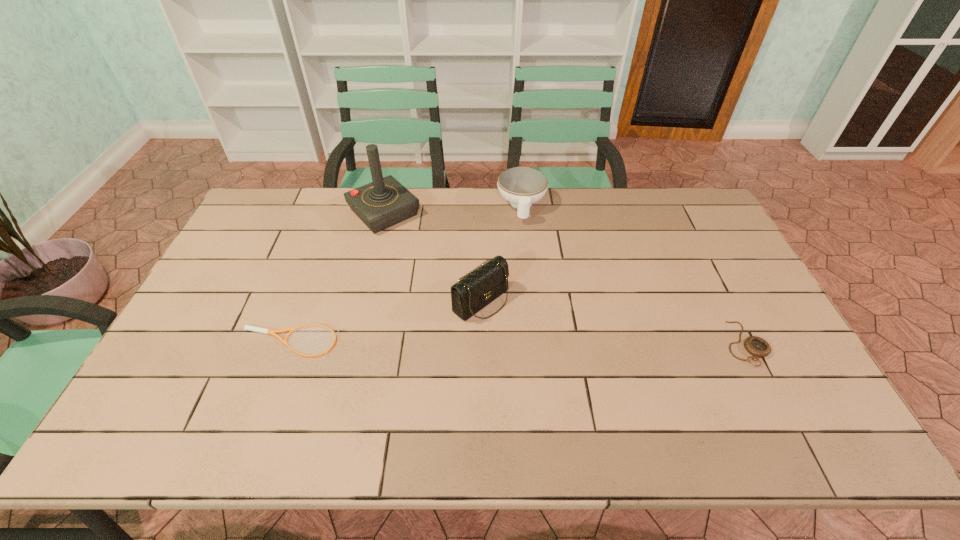
At what (x,y) coordinates should I click in order to perform the action: click on vacant space at the far edge of the desktop. Please return your answer as a coordinate pair (x, y). Image resolution: width=960 pixels, height=540 pixels. Looking at the image, I should click on (435, 187).

I want to click on vacant area at the near edge, so click(x=635, y=372).

In order to click on vacant region at the left edge of the desktop in this screenshot , I will do `click(262, 257)`.

This screenshot has width=960, height=540. In order to click on vacant space at the right edge of the desktop in this screenshot , I will do `click(776, 362)`.

I want to click on free space at the far left corner, so click(251, 221).

Identify the location of vacant space that is in between the shortest object and the fourth shortest object. (385, 321).

You are a GUI agent. You are given a task and a screenshot of the screen. Output one action in this format:
    pyautogui.click(x=<x>, y=<y>)
    Task: Click on the free space that is in between the third tallest object and the joystick
    Image resolution: width=960 pixels, height=540 pixels.
    Given the screenshot: What is the action you would take?
    pyautogui.click(x=453, y=209)

Find the location of a particular element. free point between the third tallest object and the second tallest object is located at coordinates (501, 253).

This screenshot has width=960, height=540. In order to click on vacant space that's between the fourth tallest object and the shortest object in this screenshot , I will do `click(517, 343)`.

Find the location of `vacant area between the chinaware and the fourth shortest object`. vacant area between the chinaware and the fourth shortest object is located at coordinates (501, 253).